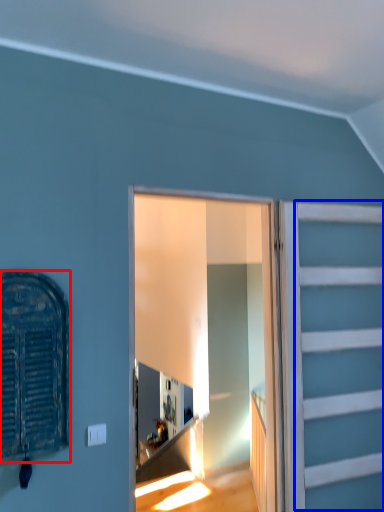
Question: Which point is closer to the camera, window (highlighted by a red box) or garage door (highlighted by a blue box)?

Choices:
 (A) window
 (B) garage door

Answer: (A)